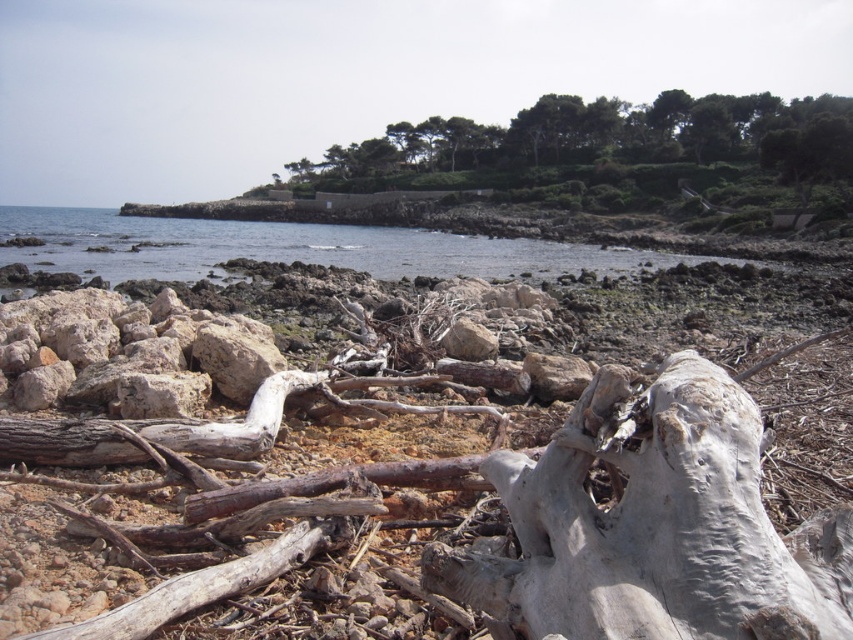
Question: Is white weathered wood at center closer to the viewer compared to clear blue water at center?

Choices:
 (A) no
 (B) yes

Answer: (B)

Question: Which point is closer to the camera taking this photo?

Choices:
 (A) (828, 161)
 (B) (622, 252)
 (C) (550, 470)

Answer: (C)

Question: Can you confirm if green leafy trees at upper center is wider than clear blue water at center?

Choices:
 (A) yes
 (B) no

Answer: (B)

Question: Does green leafy trees at upper center come in front of clear blue water at center?

Choices:
 (A) no
 (B) yes

Answer: (A)

Question: Which point is closer to the camera taking this photo?

Choices:
 (A) (503, 184)
 (B) (352, 268)

Answer: (B)

Question: Which point is farther to the camera?

Choices:
 (A) (22, 253)
 (B) (473, 144)

Answer: (B)